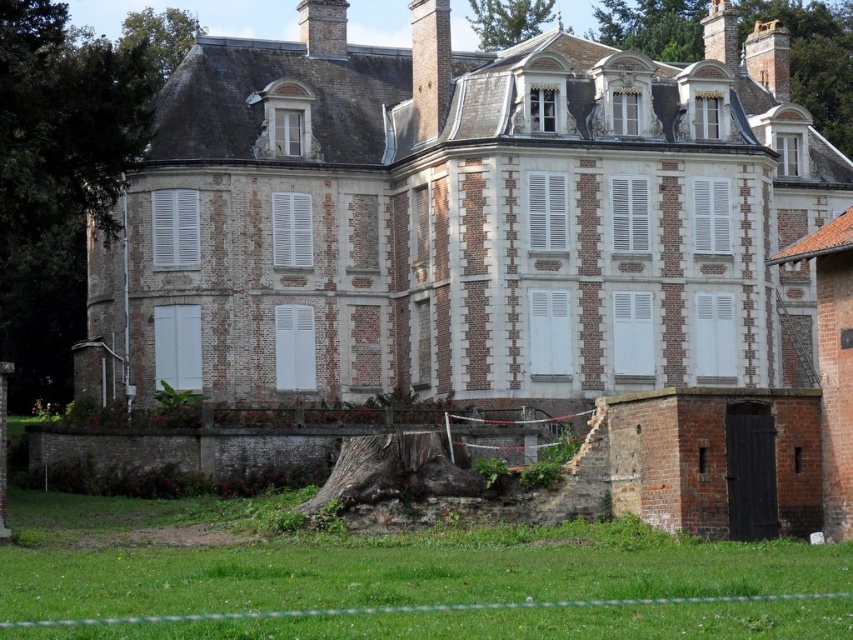
You are standing in front of the historic building and notice two chimneys on the roof. Which chimney is located to the left of the other? The smooth gray chimney at upper center or the smooth stone chimney at upper right?

The smooth gray chimney at upper center is positioned on the left side of the smooth stone chimney at upper right.

You are standing in front of a historic building and want to take a photo of a specific point marked at coordinates point (x=440, y=42). If your camera can focus on objects up to 100 meters away, will you be able to capture that point clearly?

The distance of point (x=440, y=42) from the camera is 80.84 meters, which is within the camera focus range of up to 100 meters. Therefore, you can capture the point clearly.

You are standing in front of the historic building and notice two chimneys on the roof. Which chimney, the brick chimney at upper center or the smooth brick chimney at upper right, is located to the left of the other?

The brick chimney at upper center is positioned on the left side of smooth brick chimney at upper right.